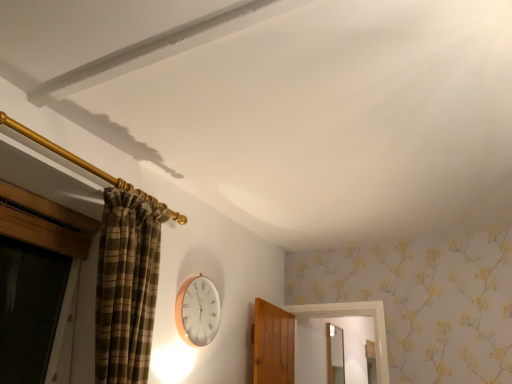
Question: From a real-world perspective, is white wooden clock at center above or below matte silver mirror at center?

Choices:
 (A) below
 (B) above

Answer: (A)

Question: Considering their positions, is white wooden clock at center located in front of or behind matte silver mirror at center?

Choices:
 (A) front
 (B) behind

Answer: (A)

Question: Considering the positions of white wooden clock at center and matte silver mirror at center in the image, is white wooden clock at center taller or shorter than matte silver mirror at center?

Choices:
 (A) short
 (B) tall

Answer: (A)

Question: Is point pos(327,324) positioned closer to the camera than point pos(206,322)?

Choices:
 (A) closer
 (B) farther

Answer: (B)

Question: Is matte silver mirror at center situated inside white wooden clock at center or outside?

Choices:
 (A) outside
 (B) inside

Answer: (A)

Question: Considering the positions of matte silver mirror at center and white wooden clock at center in the image, is matte silver mirror at center bigger or smaller than white wooden clock at center?

Choices:
 (A) small
 (B) big

Answer: (B)

Question: From the image's perspective, is matte silver mirror at center above or below white wooden clock at center?

Choices:
 (A) above
 (B) below

Answer: (B)